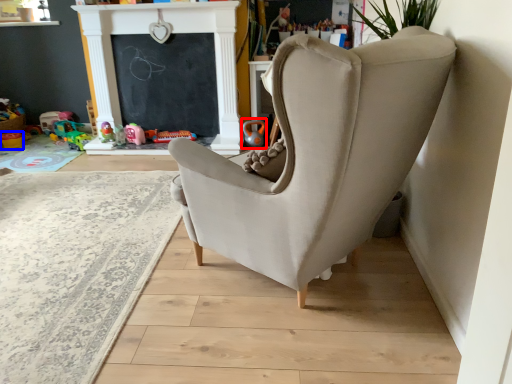
Question: Among these objects, which one is nearest to the camera, toy (highlighted by a red box) or toy (highlighted by a blue box)?

Choices:
 (A) toy
 (B) toy

Answer: (A)